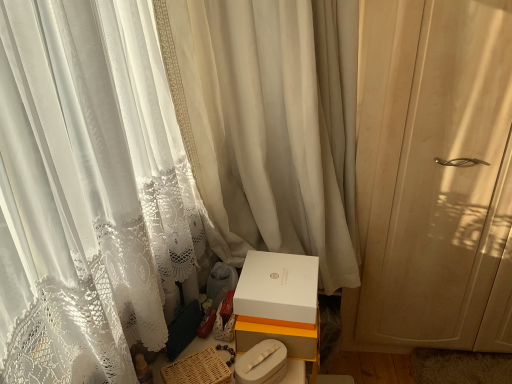
Question: Should I look upward or downward to see woven brown basket at lower center?

Choices:
 (A) up
 (B) down

Answer: (B)

Question: Considering the relative sizes of white sheer curtain at center, which appears as the first curtain when viewed from the left, and white matte box at lower center, the first box in the top-to-bottom sequence, in the image provided, is white sheer curtain at center, which appears as the first curtain when viewed from the left, taller than white matte box at lower center, the first box in the top-to-bottom sequence,?

Choices:
 (A) yes
 (B) no

Answer: (A)

Question: Is the position of white sheer curtain at center, which appears as the first curtain when viewed from the left, more distant than that of white matte box at lower center, the first box in the top-to-bottom sequence?

Choices:
 (A) no
 (B) yes

Answer: (A)

Question: Is white sheer curtain at center, positioned as the 2th curtain in right-to-left order, positioned beyond the bounds of white matte box at lower center, the second box when ordered from bottom to top?

Choices:
 (A) no
 (B) yes

Answer: (B)

Question: Is white matte box at lower center, the second box when ordered from bottom to top, a part of white sheer curtain at center, positioned as the 2th curtain in right-to-left order?

Choices:
 (A) yes
 (B) no

Answer: (A)

Question: Can you confirm if white sheer curtain at center, which appears as the first curtain when viewed from the left, is bigger than white matte box at lower center, the first box in the top-to-bottom sequence?

Choices:
 (A) yes
 (B) no

Answer: (A)

Question: Does white sheer curtain at center, which appears as the first curtain when viewed from the left, turn towards white matte box at lower center, the first box in the top-to-bottom sequence?

Choices:
 (A) no
 (B) yes

Answer: (B)

Question: Does white sheer curtain at center, which appears as the first curtain when viewed from the left, appear on the left side of white lace curtain at right, which ranks as the 2th curtain in left-to-right order?

Choices:
 (A) no
 (B) yes

Answer: (B)

Question: From a real-world perspective, is white sheer curtain at center, positioned as the 2th curtain in right-to-left order, under white lace curtain at right, which ranks as the 2th curtain in left-to-right order?

Choices:
 (A) yes
 (B) no

Answer: (B)

Question: From a real-world perspective, is white sheer curtain at center, which appears as the first curtain when viewed from the left, positioned over white lace curtain at right, arranged as the 1th curtain when viewed from the right, based on gravity?

Choices:
 (A) yes
 (B) no

Answer: (A)

Question: Considering the relative sizes of white sheer curtain at center, which appears as the first curtain when viewed from the left, and white lace curtain at right, arranged as the 1th curtain when viewed from the right, in the image provided, is white sheer curtain at center, which appears as the first curtain when viewed from the left, shorter than white lace curtain at right, arranged as the 1th curtain when viewed from the right,?

Choices:
 (A) no
 (B) yes

Answer: (B)

Question: Can you confirm if white sheer curtain at center, which appears as the first curtain when viewed from the left, is wider than white lace curtain at right, which ranks as the 2th curtain in left-to-right order?

Choices:
 (A) yes
 (B) no

Answer: (A)

Question: Is white sheer curtain at center, which appears as the first curtain when viewed from the left, behind white lace curtain at right, arranged as the 1th curtain when viewed from the right?

Choices:
 (A) no
 (B) yes

Answer: (A)

Question: Is woven brown basket at lower center not near white sheer curtain at center, positioned as the 2th curtain in right-to-left order?

Choices:
 (A) yes
 (B) no

Answer: (B)